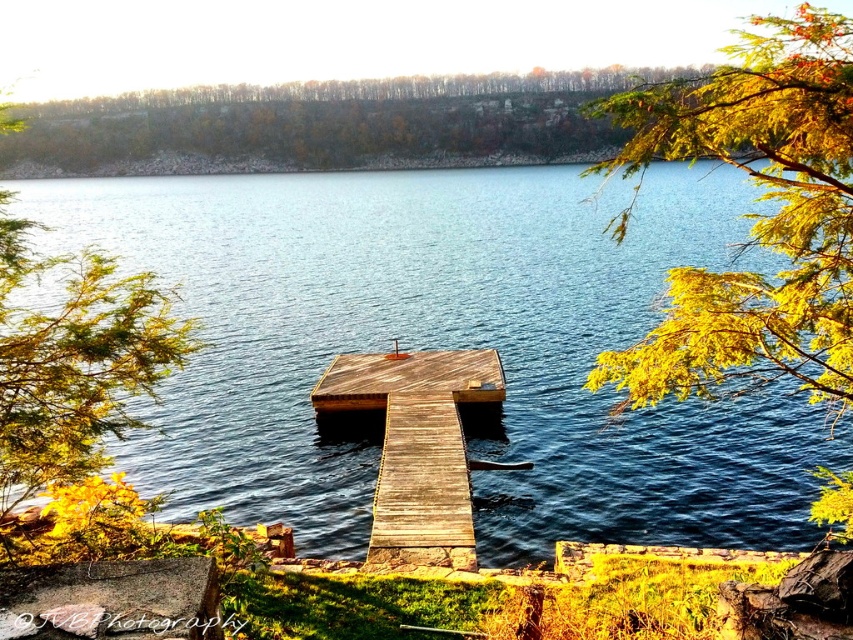
Who is shorter, yellow-green leaves at upper right or green leafy tree at left?

yellow-green leaves at upper right

Can you confirm if yellow-green leaves at upper right is thinner than green leafy tree at left?

Indeed, yellow-green leaves at upper right has a lesser width compared to green leafy tree at left.

Locate an element on the screen. The width and height of the screenshot is (853, 640). yellow-green leaves at upper right is located at coordinates (753, 216).

Who is more distant from viewer, (236, 278) or (648, 141)?

The point (236, 278) is behind.

Is point (235, 397) closer to viewer compared to point (824, 157)?

No, (235, 397) is further to viewer.

Between point (276, 220) and point (712, 372), which one is positioned in front?

Point (712, 372) is in front.

Image resolution: width=853 pixels, height=640 pixels. I want to click on blue water at center, so click(x=445, y=348).

Who is more distant from viewer, (x=0, y=250) or (x=393, y=438)?

Positioned behind is point (x=393, y=438).

Between green leafy tree at left and weathered wood dock at center, which one has less height?

Standing shorter between the two is weathered wood dock at center.

The height and width of the screenshot is (640, 853). Find the location of `green leafy tree at left`. green leafy tree at left is located at coordinates (74, 362).